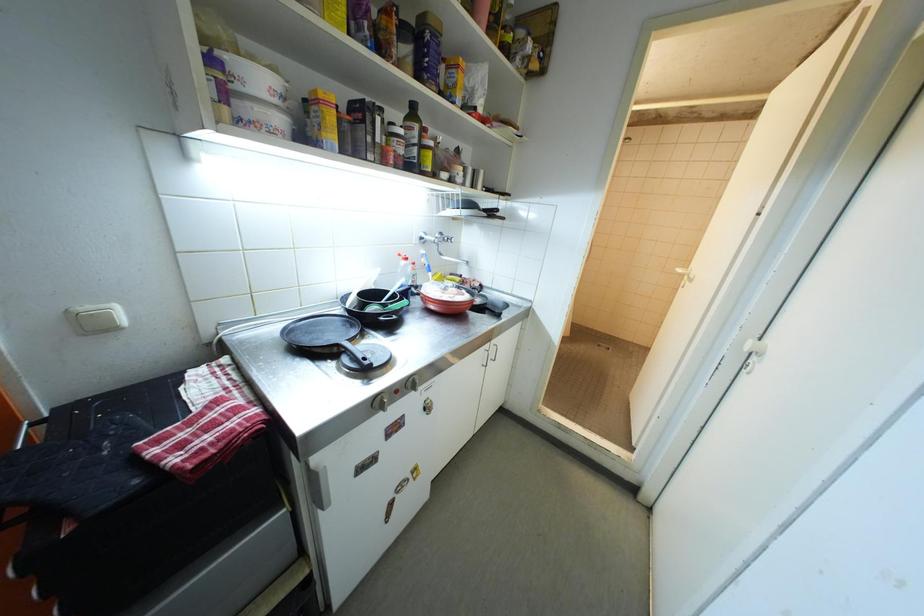
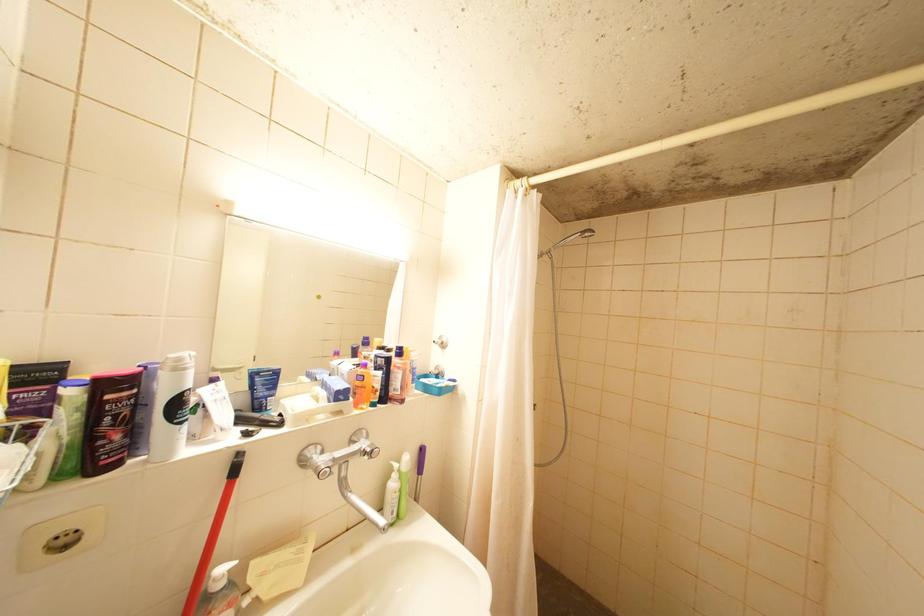
Which direction would the cameraman need to move to produce the second image?

The cameraman walked toward right, forward.